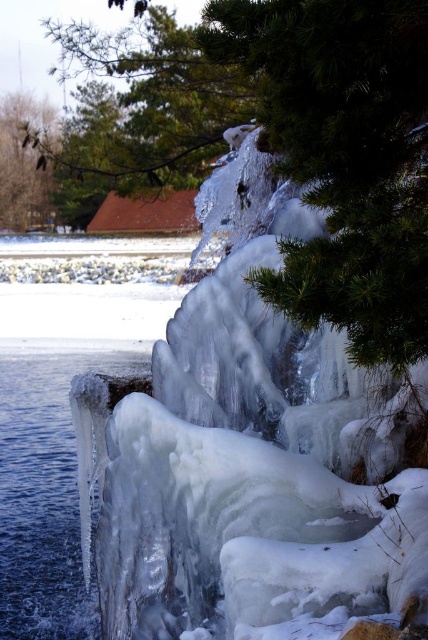
Between green matte tree at upper center and clear ice water at lower left, which one appears on the right side from the viewer's perspective?

Positioned to the right is green matte tree at upper center.

Identify the location of green matte tree at upper center. (139, 109).

The width and height of the screenshot is (428, 640). I want to click on green matte tree at upper center, so click(139, 109).

Which is more to the left, clear ice water at lower left or green textured pine branch at upper left?

Positioned to the left is green textured pine branch at upper left.

Is clear ice water at lower left shorter than green textured pine branch at upper left?

Indeed, clear ice water at lower left has a lesser height compared to green textured pine branch at upper left.

Describe the element at coordinates (44, 490) in the screenshot. This screenshot has height=640, width=428. I see `clear ice water at lower left` at that location.

Where is `clear ice water at lower left`? Image resolution: width=428 pixels, height=640 pixels. clear ice water at lower left is located at coordinates (44, 490).

Who is lower down, green matte tree at upper center or green textured pine branch at upper left?

green textured pine branch at upper left

Is point (151, 17) closer to camera compared to point (17, 102)?

Yes, point (151, 17) is in front of point (17, 102).

Where is `green matte tree at upper center`? The height and width of the screenshot is (640, 428). green matte tree at upper center is located at coordinates (139, 109).